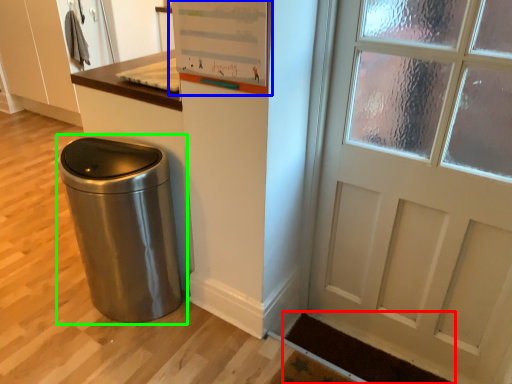
Question: Which object is the closest to the doormat (highlighted by a red box)? Choose among these: bulletin board (highlighted by a blue box) or waste container (highlighted by a green box).

Choices:
 (A) bulletin board
 (B) waste container

Answer: (B)